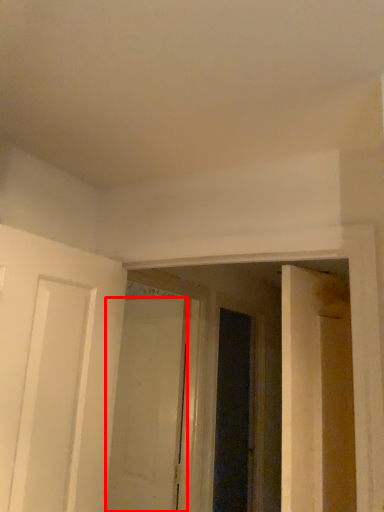
Question: Observing the image, what is the correct spatial positioning of door (annotated by the red box) in reference to screen door?

Choices:
 (A) right
 (B) left

Answer: (B)